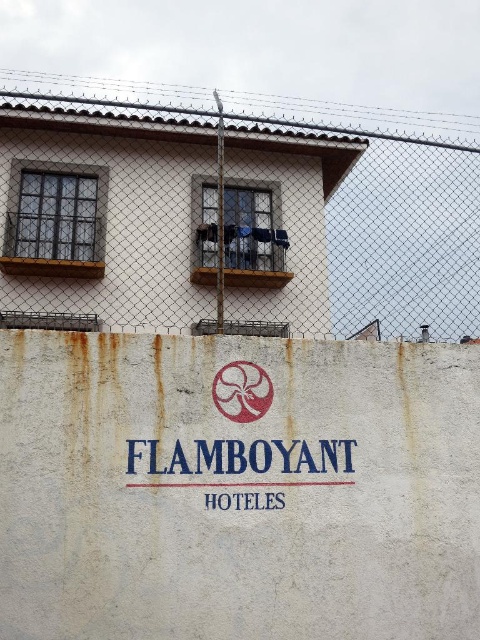
From the picture: Is wire mesh fence at upper center further to the viewer compared to red matte flower at center?

Yes, wire mesh fence at upper center is behind red matte flower at center.

Looking at this image, is wire mesh fence at upper center thinner than red matte flower at center?

Incorrect, wire mesh fence at upper center's width is not less than red matte flower at center's.

Does point (36, 145) come in front of point (242, 372)?

No, it is behind (242, 372).

Locate an element on the screen. The image size is (480, 640). wire mesh fence at upper center is located at coordinates click(349, 228).

Which is below, red matte flower at center or white matte sign at center?

white matte sign at center is below.

Is point (239, 376) less distant than point (271, 497)?

No, it is behind (271, 497).

Who is more distant from viewer, (251,401) or (284,506)?

The point (251,401) is behind.

Where is `red matte flower at center`? red matte flower at center is located at coordinates (241, 392).

Does wire mesh fence at upper center appear on the left side of white matte sign at center?

Indeed, wire mesh fence at upper center is positioned on the left side of white matte sign at center.

The width and height of the screenshot is (480, 640). What are the coordinates of `wire mesh fence at upper center` in the screenshot? It's located at (349, 228).